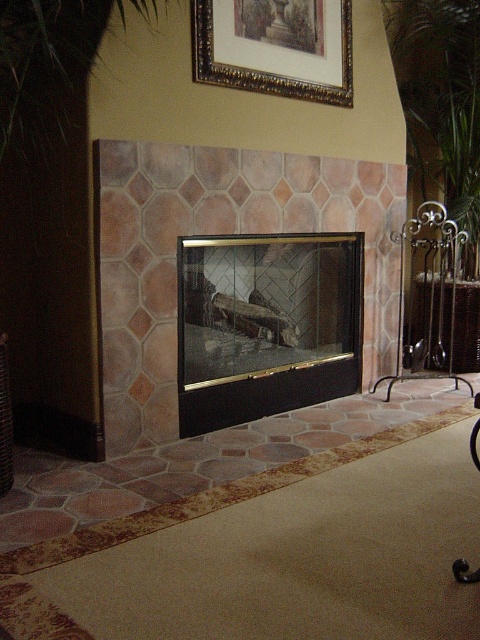
Question: Which object is positioned farthest from the green leafy plant at right?

Choices:
 (A) green leafy plant at upper center
 (B) black plastic swivel chair at lower right

Answer: (A)

Question: Which point is closer to the camera?

Choices:
 (A) rustic stone fireplace at center
 (B) black wrought iron fireplace tool rack at right
 (C) black glass fireplace at center

Answer: (A)

Question: Is the position of black glass fireplace at center more distant than that of gold/gilded picture frame at upper center?

Choices:
 (A) yes
 (B) no

Answer: (A)

Question: Does rustic stone fireplace at center have a larger size compared to black glass fireplace at center?

Choices:
 (A) yes
 (B) no

Answer: (A)

Question: Is rustic stone fireplace at center in front of black wrought iron fireplace tool rack at right?

Choices:
 (A) no
 (B) yes

Answer: (B)

Question: Which of the following is the closest to the observer?

Choices:
 (A) green leafy plant at upper center
 (B) black plastic swivel chair at lower right
 (C) gold/gilded picture frame at upper center
 (D) black wrought iron fireplace tool rack at right

Answer: (A)